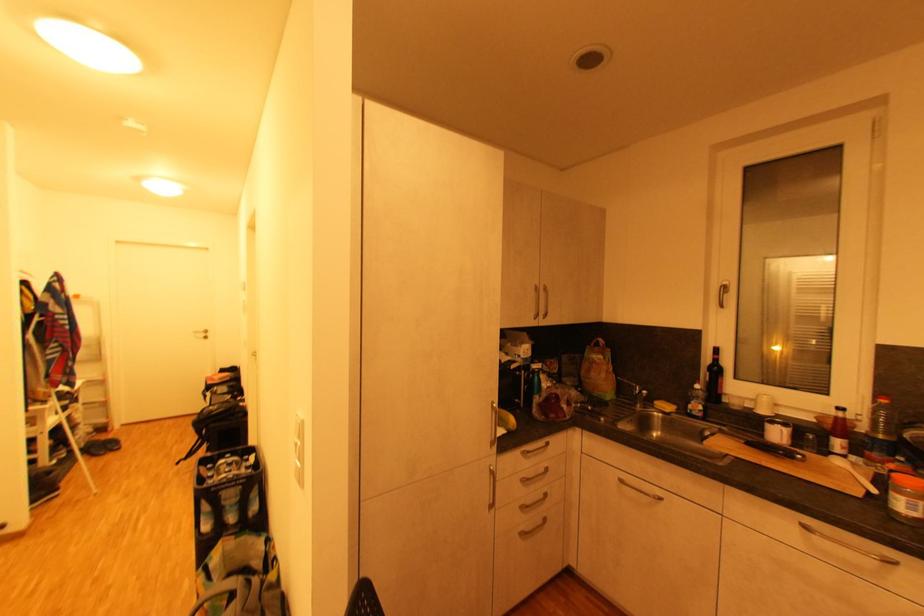
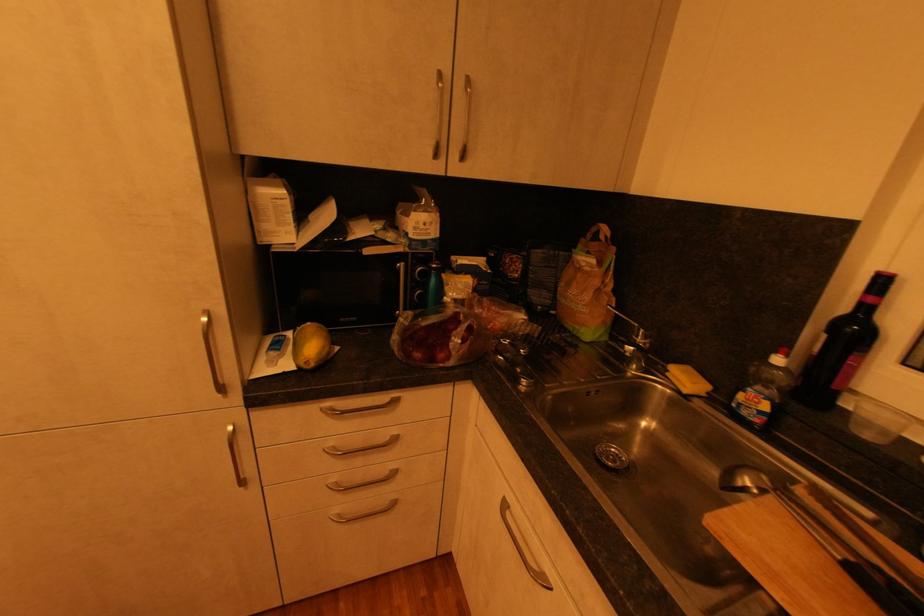
Where in the second image is the point corresponding to [526,454] from the first image?

(325, 410)